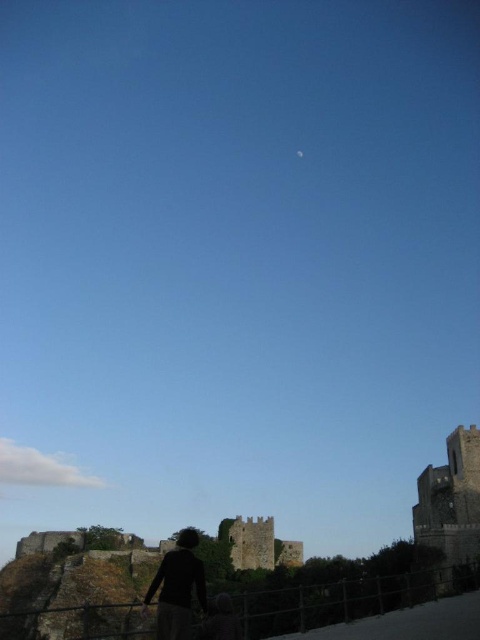
You are standing at the metal railing on the paved pathway leading to the castle. You see two points in the scene, one at point coordinates point (432, 476) and another at point (193, 563). Which point is closer to your current position?

Point (432, 476) is closer to your current position because it is further to the camera than point (193, 563), meaning it is nearer to the observer standing at the metal railing.

You are standing at the metal railing bordering the paved pathway in the foreground. You want to walk directly towards the silhouette fabric person at lower center. In which direction should you head?

Since the silhouette fabric person at lower center is located at point (178,588), you should head towards the lower center direction to reach them.